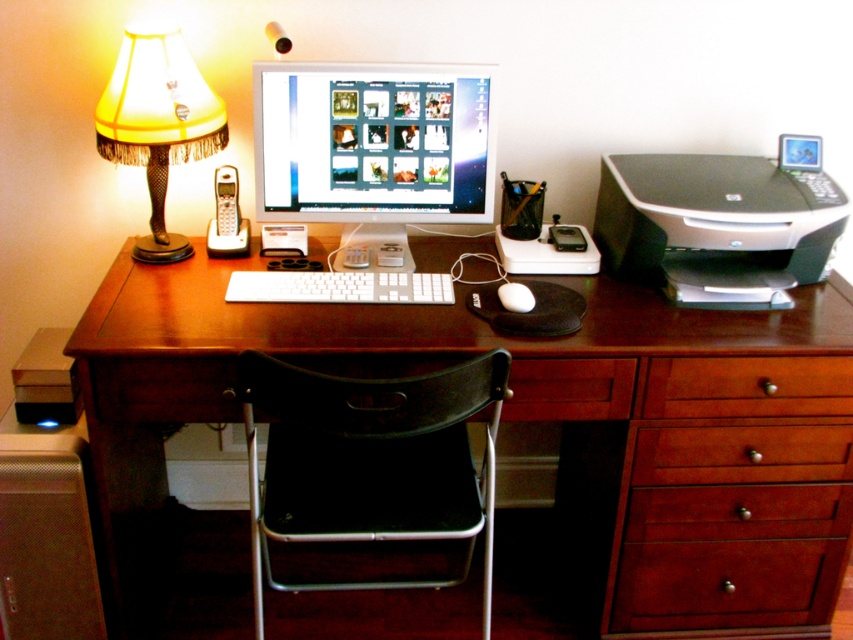
Which is above, wooden drawer at right or white matte keyboard at center?

white matte keyboard at center is above.

Does point (706, 396) lie in front of point (419, 280)?

Yes, it is in front of point (419, 280).

Where is `wooden drawer at right`? wooden drawer at right is located at coordinates (747, 387).

Describe the element at coordinates (428, 371) in the screenshot. I see `wooden computer desk at center` at that location.

Is point (296, 328) farther from camera compared to point (476, 492)?

No, it is not.

Who is more distant from viewer, [430,344] or [440,531]?

The point [430,344] is more distant.

Find the location of a particular element. The height and width of the screenshot is (640, 853). wooden computer desk at center is located at coordinates (428, 371).

Does black fabric chair at center appear under silver plastic printer at right?

Indeed, black fabric chair at center is positioned under silver plastic printer at right.

Who is positioned more to the left, black fabric chair at center or silver plastic printer at right?

black fabric chair at center

Is point (361, 481) behind point (727, 200)?

No, it is not.

Image resolution: width=853 pixels, height=640 pixels. I want to click on black fabric chair at center, so click(369, 460).